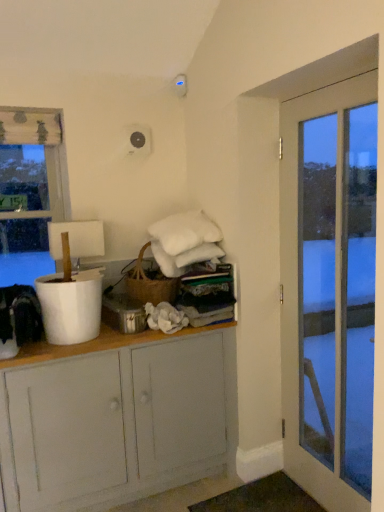
Question: Can you confirm if white glass door at right is positioned to the right of white painted wood cabinet at center?

Choices:
 (A) no
 (B) yes

Answer: (B)

Question: Is white painted wood cabinet at center completely or partially inside white glass door at right?

Choices:
 (A) no
 (B) yes

Answer: (A)

Question: Could you tell me if white glass door at right is turned towards white painted wood cabinet at center?

Choices:
 (A) yes
 (B) no

Answer: (B)

Question: Is white glass door at right taller than white painted wood cabinet at center?

Choices:
 (A) no
 (B) yes

Answer: (B)

Question: Is white glass door at right oriented away from white painted wood cabinet at center?

Choices:
 (A) no
 (B) yes

Answer: (A)

Question: Looking at the image, does white painted wood cabinet at center seem bigger or smaller compared to white glass door at right?

Choices:
 (A) big
 (B) small

Answer: (A)

Question: From their relative heights in the image, would you say white painted wood cabinet at center is taller or shorter than white glass door at right?

Choices:
 (A) short
 (B) tall

Answer: (A)

Question: From the image's perspective, is white painted wood cabinet at center located above or below white glass door at right?

Choices:
 (A) above
 (B) below

Answer: (B)

Question: In terms of width, does white painted wood cabinet at center look wider or thinner when compared to white glass door at right?

Choices:
 (A) thin
 (B) wide

Answer: (B)

Question: Is transparent glass window at left situated inside white glass door at right or outside?

Choices:
 (A) inside
 (B) outside

Answer: (B)

Question: Is point (23, 254) closer or farther from the camera than point (337, 183)?

Choices:
 (A) closer
 (B) farther

Answer: (B)

Question: Considering the positions of transparent glass window at left and white glass door at right in the image, is transparent glass window at left bigger or smaller than white glass door at right?

Choices:
 (A) big
 (B) small

Answer: (B)

Question: Visually, is transparent glass window at left positioned to the left or to the right of white glass door at right?

Choices:
 (A) left
 (B) right

Answer: (A)

Question: In the image, is white glass door at right positioned in front of or behind transparent glass window at left?

Choices:
 (A) behind
 (B) front

Answer: (B)

Question: Considering the relative positions of white glass door at right and transparent glass window at left in the image provided, is white glass door at right to the left or to the right of transparent glass window at left?

Choices:
 (A) right
 (B) left

Answer: (A)